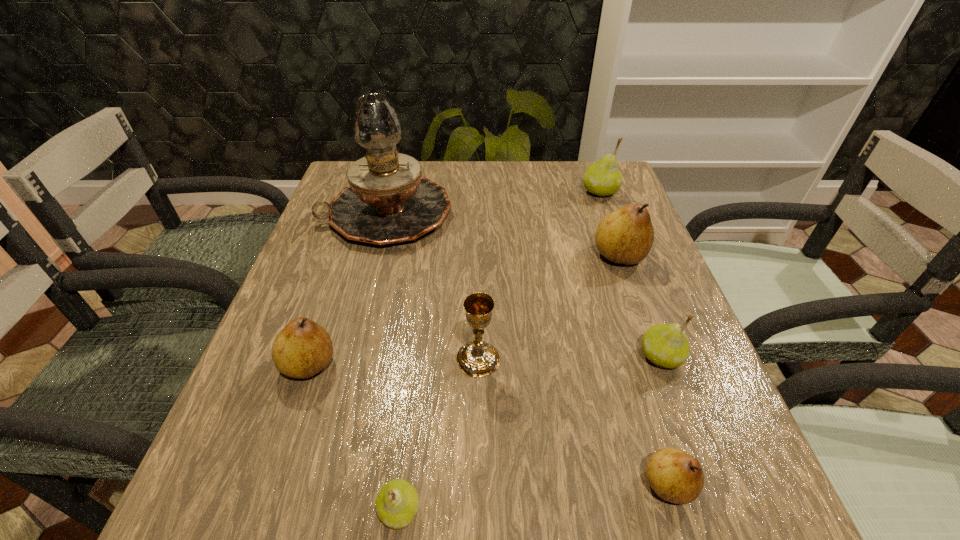
What are the coordinates of `empty space that is in between the smallest brown pear and the second biggest brown pear` in the screenshot? It's located at click(489, 424).

Locate an element on the screen. The width and height of the screenshot is (960, 540). vacant area that lies between the chalice and the smallest green pear is located at coordinates tap(439, 435).

Choose which object is the third nearest neighbor to the leftmost brown pear. Please provide its 2D coordinates. Your answer should be formatted as a tuple, i.e. [(x, y)], where the tuple contains the x and y coordinates of a point satisfying the conditions above.

[(388, 201)]

Point out which object is positioned as the nearest to the second smallest green pear. Please provide its 2D coordinates. Your answer should be formatted as a tuple, i.e. [(x, y)], where the tuple contains the x and y coordinates of a point satisfying the conditions above.

[(676, 476)]

Point out which pear is positioned as the fifth nearest to the second nearest green pear. Please provide its 2D coordinates. Your answer should be formatted as a tuple, i.e. [(x, y)], where the tuple contains the x and y coordinates of a point satisfying the conditions above.

[(303, 348)]

Point out which pear is positioned as the nearest to the chalice. Please provide its 2D coordinates. Your answer should be formatted as a tuple, i.e. [(x, y)], where the tuple contains the x and y coordinates of a point satisfying the conditions above.

[(397, 503)]

Where is `green pear that is the second closest to the farthest pear`? green pear that is the second closest to the farthest pear is located at coordinates (397, 503).

Find the location of a particular element. This screenshot has width=960, height=540. green pear that is the second closest to the second smallest green pear is located at coordinates (603, 178).

Where is `brown pear that is the closest to the nearest brown pear`? The image size is (960, 540). brown pear that is the closest to the nearest brown pear is located at coordinates [626, 235].

Identify which brown pear is the third nearest to the second pear from left to right. Please provide its 2D coordinates. Your answer should be formatted as a tuple, i.e. [(x, y)], where the tuple contains the x and y coordinates of a point satisfying the conditions above.

[(626, 235)]